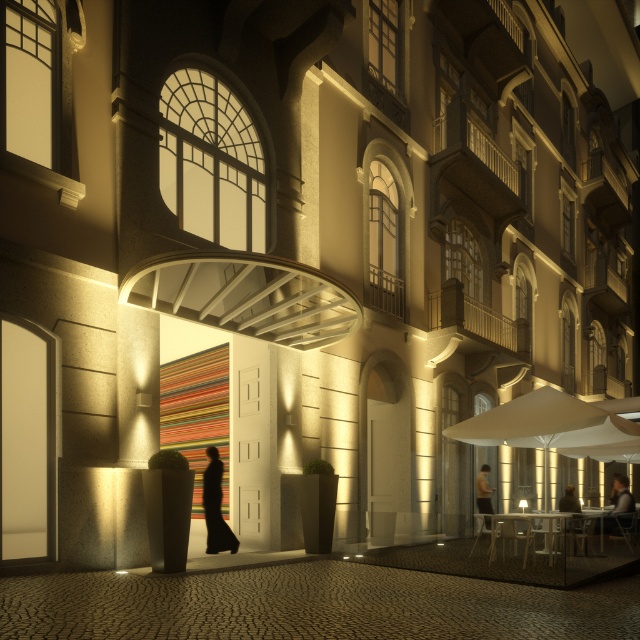
Question: Which point appears closest to the camera in this image?

Choices:
 (A) (224, 524)
 (B) (624, 499)
 (C) (484, 509)

Answer: (A)

Question: Among these points, which one is farthest from the camera?

Choices:
 (A) (228, 532)
 (B) (609, 529)

Answer: (B)

Question: Does dark gray sweater at lower right have a greater width compared to dark brown leather jacket at lower right?

Choices:
 (A) yes
 (B) no

Answer: (A)

Question: Estimate the real-world distances between objects in this image. Which object is farther from the dark gray sweater at lower right?

Choices:
 (A) black fabric person at center
 (B) dark brown leather jacket at lower right

Answer: (A)

Question: Is dark gray sweater at lower right smaller than dark brown leather jacket at lower right?

Choices:
 (A) yes
 (B) no

Answer: (B)

Question: Observing the image, what is the correct spatial positioning of black fabric person at center in reference to dark brown leather jacket at lower right?

Choices:
 (A) above
 (B) below

Answer: (A)